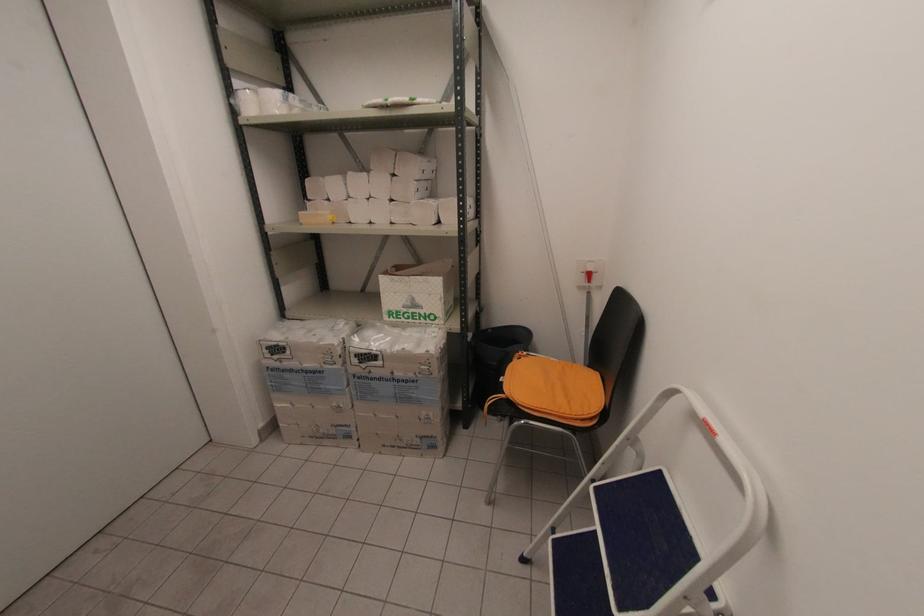
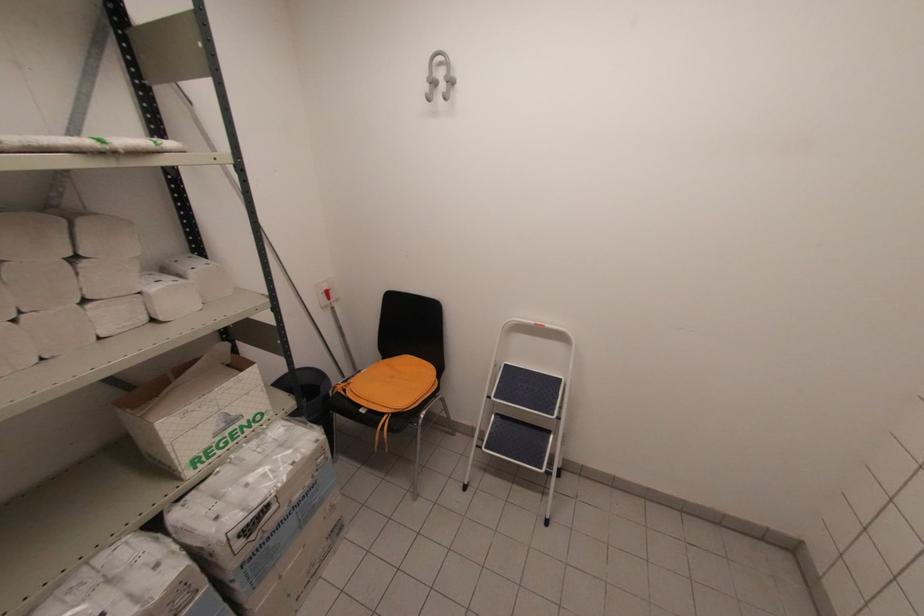
The point at (410, 304) is marked in the first image. Where is the corresponding point in the second image?

(224, 426)